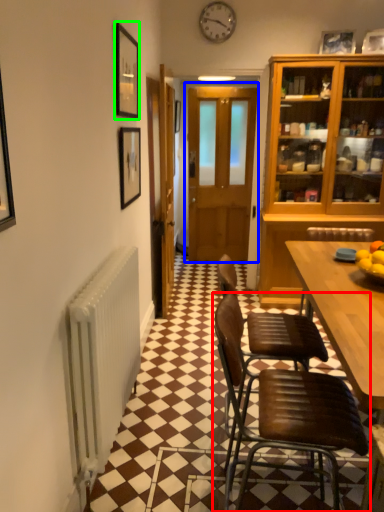
Question: Estimate the real-world distances between objects in this image. Which object is closer to chair (highlighted by a red box), door (highlighted by a blue box) or picture frame (highlighted by a green box)?

Choices:
 (A) door
 (B) picture frame

Answer: (B)